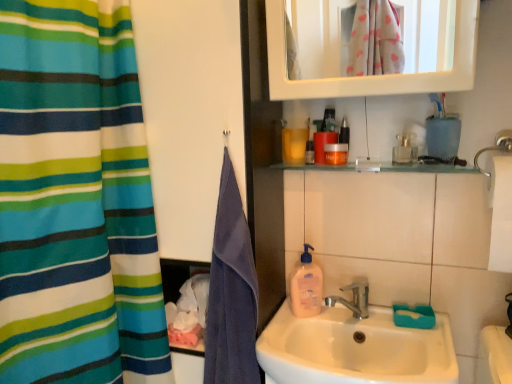
Question: Visually, is translucent plastic bottle at upper center, the fourth mouthwash from the right, positioned to the left or to the right of translucent plastic soap dispenser at sink?

Choices:
 (A) right
 (B) left

Answer: (B)

Question: From the image's perspective, relative to translucent plastic soap dispenser at sink, is translucent plastic bottle at upper center, the fourth mouthwash from the right, above or below?

Choices:
 (A) above
 (B) below

Answer: (A)

Question: Which object is the closest to the purple cotton towel at left?

Choices:
 (A) clear glass bottle at upper right, the first mouthwash positioned from the right
 (B) blue towel at left
 (C) translucent plastic soap dispenser at sink
 (D) striped fabric curtain at left
 (E) teal plastic toothbrush holder at upper right

Answer: (B)

Question: Estimate the real-world distances between objects in this image. Which object is closer to the clear glass bottle at upper right, the first mouthwash positioned from the right?

Choices:
 (A) blue towel at left
 (B) white ceramic sink at center
 (C) orange matte bottle at upper center, arranged as the third mouthwash when viewed from the left
 (D) purple cotton towel at left
 (E) translucent plastic soap dispenser at sink

Answer: (C)